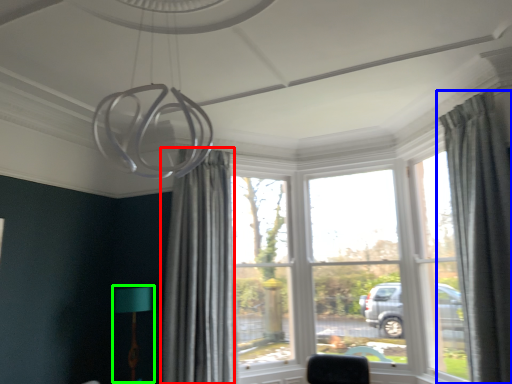
Question: Estimate the real-world distances between objects in this image. Which object is closer to curtain (highlighted by a red box), curtain (highlighted by a blue box) or table lamp (highlighted by a green box)?

Choices:
 (A) curtain
 (B) table lamp

Answer: (B)